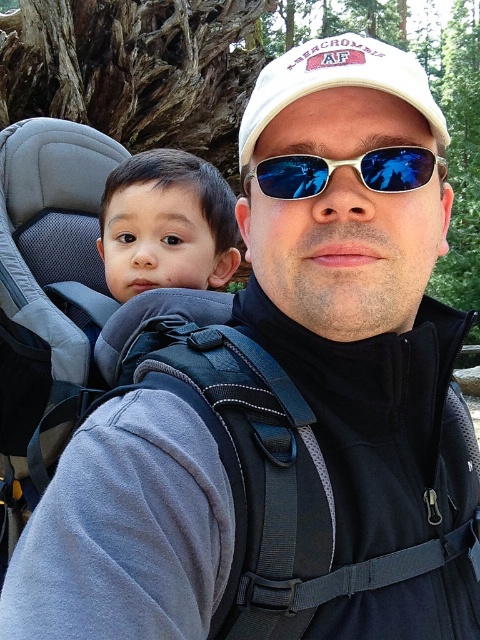
You are a photographer trying to capture a close detail shot of the baby in the smooth skin baby at center. However, the black fabric strap at center is blocking your view. Can you estimate whether the strap is larger than the baby?

The black fabric strap at center is bigger than smooth skin baby at center, so the strap is indeed larger and may be obstructing the view of the baby.

You are taking a photo of the two people in the scene. You want to focus on the baby in the carrier first. Which point should you adjust your camera focus to, point [184,278] or point [261,188]?

Point [184,278] is further to the camera than point [261,188], so you should focus on point [184,278] to capture the baby in the carrier first.